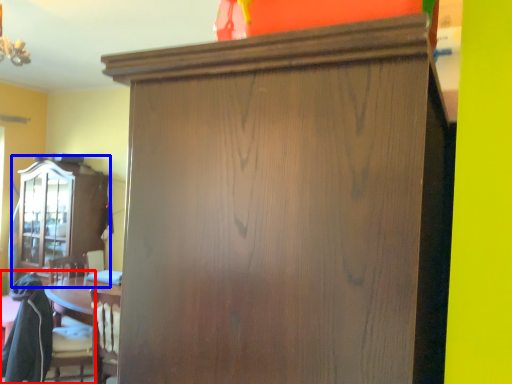
Question: Which point is closer to the camera, swivel chair (highlighted by a red box) or cabinetry (highlighted by a blue box)?

Choices:
 (A) swivel chair
 (B) cabinetry

Answer: (A)